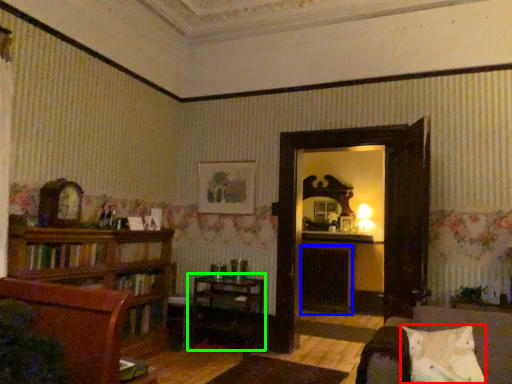
Question: Based on their relative distances, which object is nearer to pillow (highlighted by a red box)? Choose from fireplace (highlighted by a blue box) and table (highlighted by a green box).

Choices:
 (A) fireplace
 (B) table

Answer: (B)